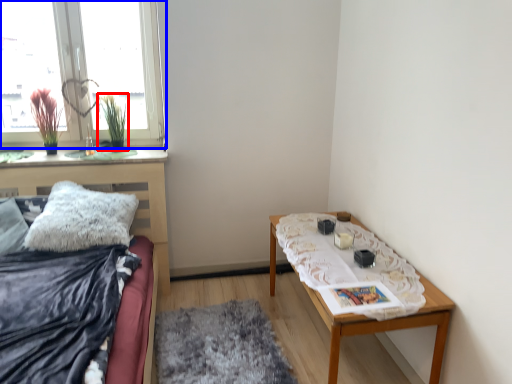
Question: Among these objects, which one is farthest to the camera, plant (highlighted by a red box) or window (highlighted by a blue box)?

Choices:
 (A) plant
 (B) window

Answer: (A)